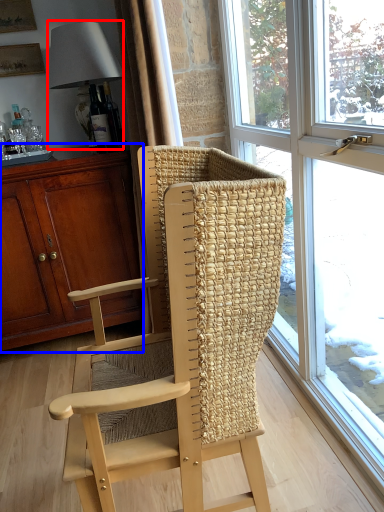
Question: Which of the following is the farthest to the observer, lamp (highlighted by a red box) or cabinetry (highlighted by a blue box)?

Choices:
 (A) lamp
 (B) cabinetry

Answer: (A)